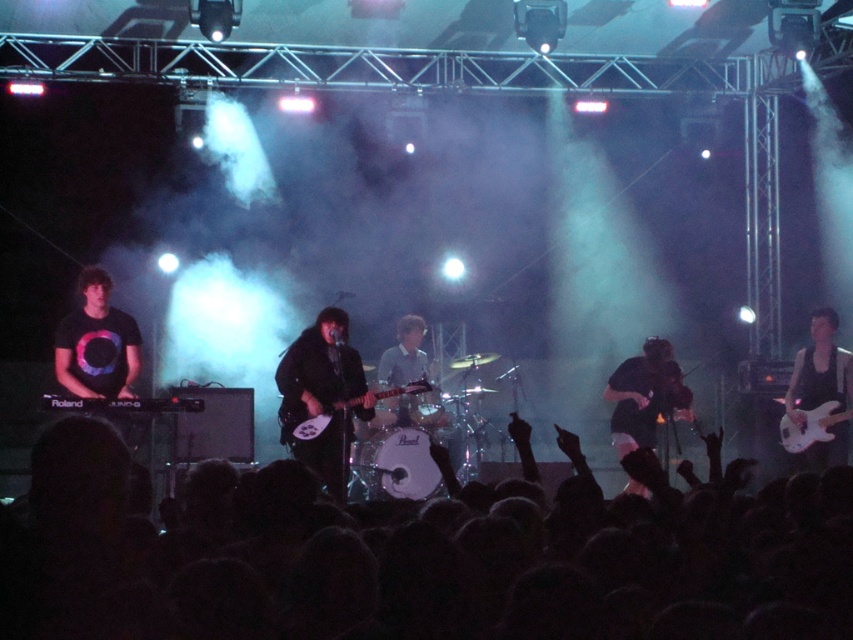
Does black matte guitar at lower right have a smaller size compared to white glossy electric guitar at right?

Incorrect, black matte guitar at lower right is not smaller in size than white glossy electric guitar at right.

Who is taller, black matte guitar at lower right or white glossy electric guitar at right?

With more height is black matte guitar at lower right.

Who is more distant from viewer, (653, 372) or (784, 449)?

Positioned behind is point (784, 449).

Locate an element on the screen. black matte guitar at lower right is located at coordinates (645, 396).

Can you confirm if black hair at lower center is smaller than black glossy guitar at right?

Actually, black hair at lower center might be larger than black glossy guitar at right.

Who is more distant from viewer, (206, 627) or (840, 349)?

Positioned behind is point (840, 349).

I want to click on black hair at lower center, so click(x=418, y=556).

Can you confirm if black matte guitar at center is bigger than black matte guitar at lower right?

Indeed, black matte guitar at center has a larger size compared to black matte guitar at lower right.

Is black matte guitar at center wider than black matte guitar at lower right?

Indeed, black matte guitar at center has a greater width compared to black matte guitar at lower right.

Who is more forward, (328, 440) or (643, 371)?

Point (328, 440)

I want to click on black matte guitar at center, so click(x=322, y=396).